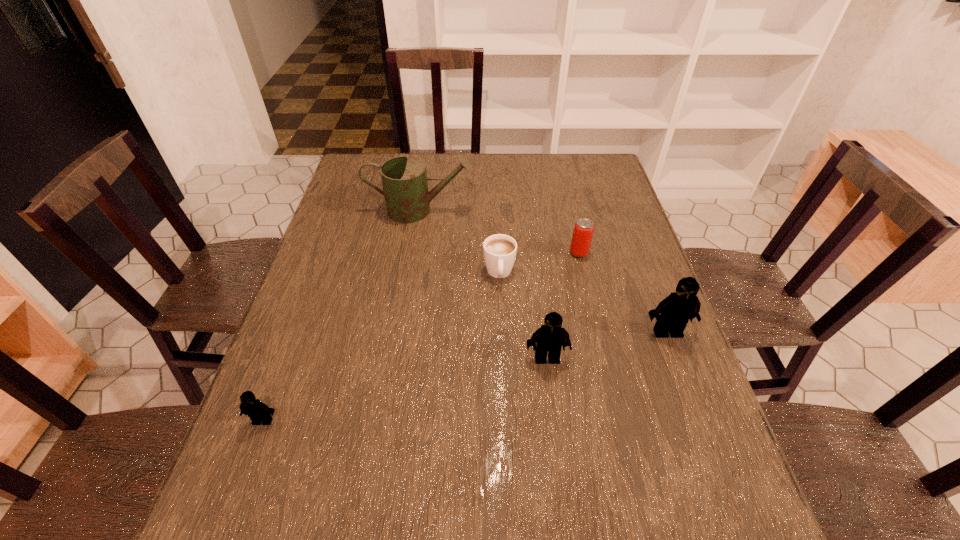
Locate an element on the screen. The height and width of the screenshot is (540, 960). empty space that is in between the nearest Lego and the fifth object from right to left is located at coordinates (342, 315).

Find the location of a particular element. The height and width of the screenshot is (540, 960). free space between the watering can and the third object from right to left is located at coordinates (484, 284).

Locate an element on the screen. The height and width of the screenshot is (540, 960). blank region between the shortest Lego and the third tallest object is located at coordinates (405, 389).

Locate an element on the screen. Image resolution: width=960 pixels, height=540 pixels. free space that is in between the third object from left to right and the second Lego from right to left is located at coordinates (523, 316).

Where is `object that stands as the closest to the beer can`? The height and width of the screenshot is (540, 960). object that stands as the closest to the beer can is located at coordinates (499, 250).

Locate an element on the screen. object that can be found as the fifth closest to the rightmost object is located at coordinates (258, 412).

Locate which Lego ranks second in proximity to the rightmost Lego. Please provide its 2D coordinates. Your answer should be formatted as a tuple, i.e. [(x, y)], where the tuple contains the x and y coordinates of a point satisfying the conditions above.

[(258, 412)]

The height and width of the screenshot is (540, 960). What are the coordinates of `Lego that is the second closest to the nearest Lego` in the screenshot? It's located at (672, 314).

Identify the location of vacant position in the image that satisfies the following two spatial constraints: 1. with the spout on the farthest object; 2. on the face of the leftmost object. The width and height of the screenshot is (960, 540). (387, 421).

Where is `free space that satisfies the following two spatial constraints: 1. on the back side of the fifth object from left to right; 2. with the spout on the second object from left to right`? free space that satisfies the following two spatial constraints: 1. on the back side of the fifth object from left to right; 2. with the spout on the second object from left to right is located at coordinates (569, 210).